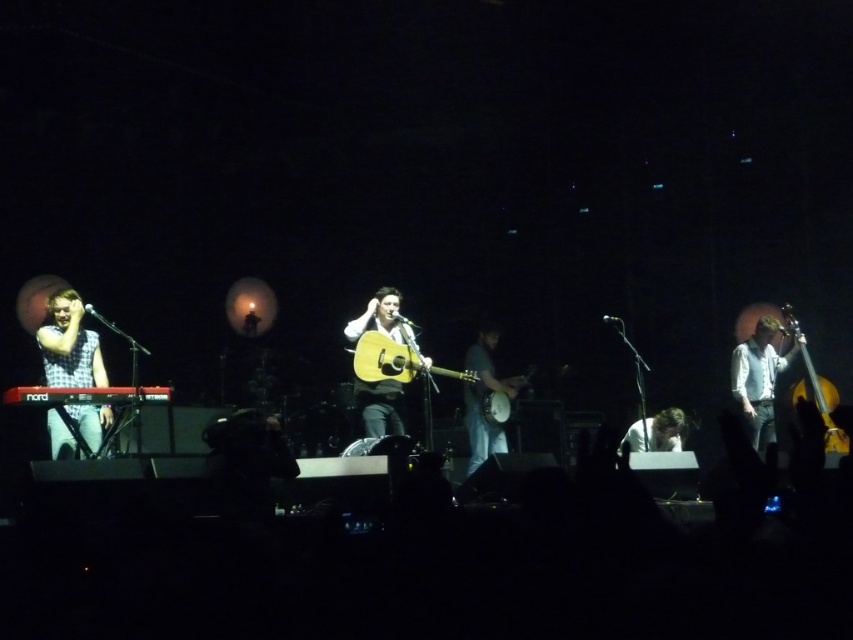
You are a photographer in the audience trying to capture a clear shot of both the black matte keyboard at lower left and the wooden acoustic guitar at center. Based on their positions, which instrument should you aim your camera towards first to ensure both are in frame?

You should aim your camera towards the black matte keyboard at lower left first since it is positioned to the left of the wooden acoustic guitar at center, allowing both instruments to be captured in the frame when centered.

You are a photographer in the audience trying to capture a clear photo of both the black matte keyboard at lower left and the shiny gold guitar at right. Based on their positions, which one is closer to the front of the stage?

The black matte keyboard at lower left is closer to the front of the stage than the shiny gold guitar at right because it is positioned in front of it.

Based on the photo, you are an event photographer positioned at the back of the venue. You notice the blue denim jeans at center on stage. Based on their position, can you estimate if they are closer to the left or right side of the stage?

The blue denim jeans at center is located at point 0.620 on the x axis, which is closer to the right side of the stage since 0.620 is more than half of 1.0. Therefore, the blue denim jeans at center are closer to the right side of the stage.